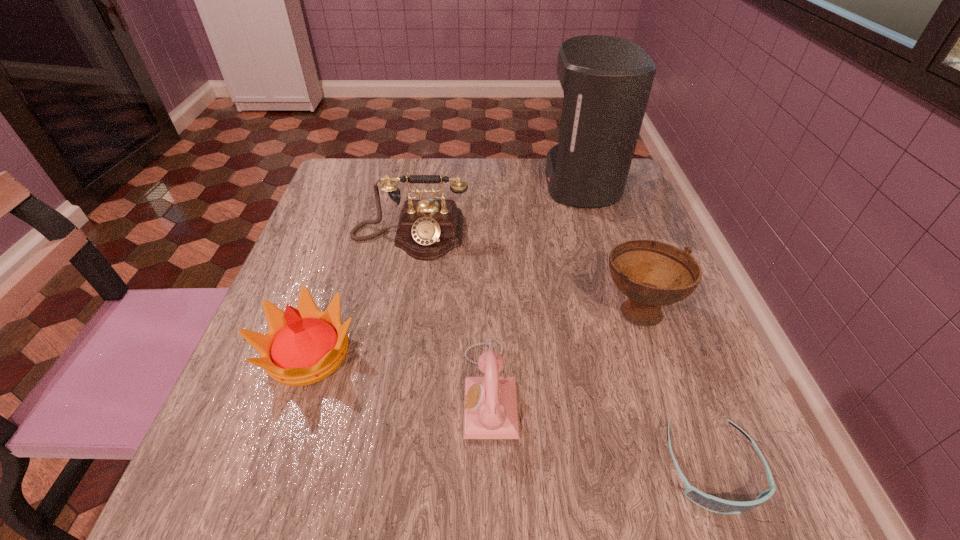
At what (x,y) coordinates should I click in order to perform the action: click on telephone located at the left edge. Please return your answer as a coordinate pair (x, y). Looking at the image, I should click on (428, 229).

This screenshot has width=960, height=540. Identify the location of crown that is at the left edge. (303, 346).

Where is `coffee maker that is at the right edge`? coffee maker that is at the right edge is located at coordinates (606, 80).

Locate an element on the screen. The image size is (960, 540). soup bowl positioned at the right edge is located at coordinates (652, 274).

Find the location of a particular element. The width and height of the screenshot is (960, 540). goggles present at the right edge is located at coordinates (708, 502).

At what (x,y) coordinates should I click in order to perform the action: click on object situated at the far right corner. Please return your answer as a coordinate pair (x, y). This screenshot has height=540, width=960. Looking at the image, I should click on (606, 80).

The width and height of the screenshot is (960, 540). What are the coordinates of `object at the near right corner` in the screenshot? It's located at (708, 502).

Identify the location of free region at the far edge. This screenshot has width=960, height=540. (481, 174).

Image resolution: width=960 pixels, height=540 pixels. Find the location of `vacant space at the near edge of the desktop`. vacant space at the near edge of the desktop is located at coordinates (636, 465).

The width and height of the screenshot is (960, 540). In the image, there is a desktop. Find the location of `vacant space at the left edge`. vacant space at the left edge is located at coordinates (324, 269).